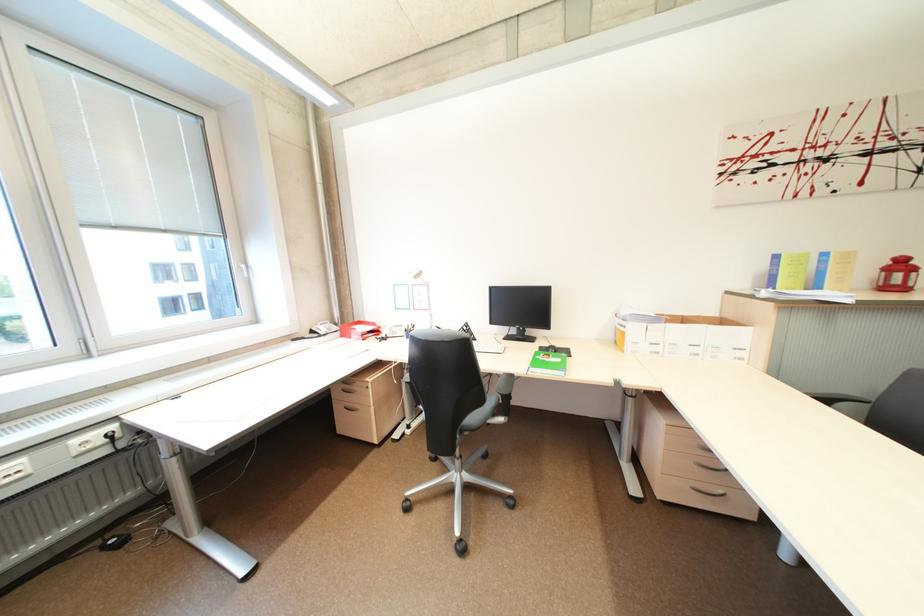
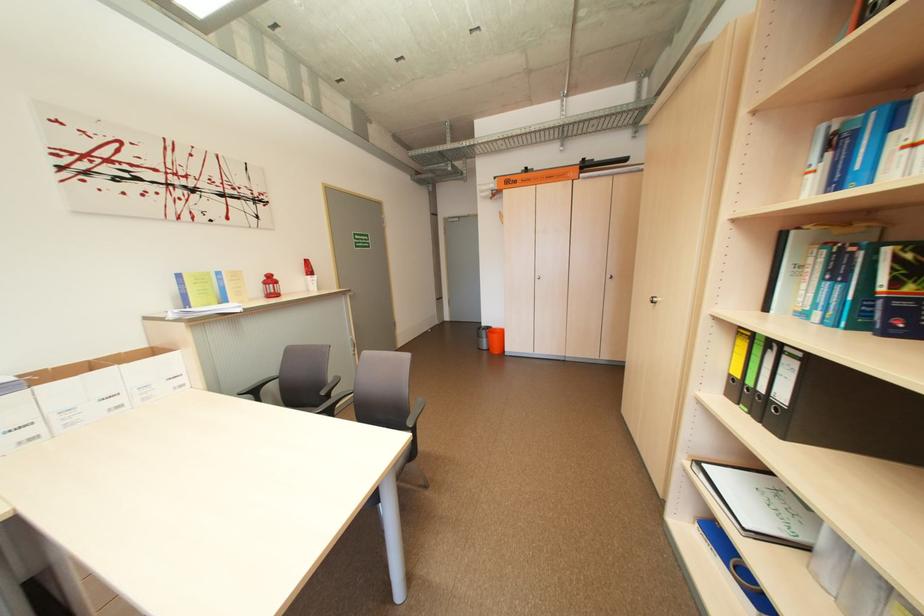
The point at (896, 270) is marked in the first image. Where is the corresponding point in the second image?

(274, 284)